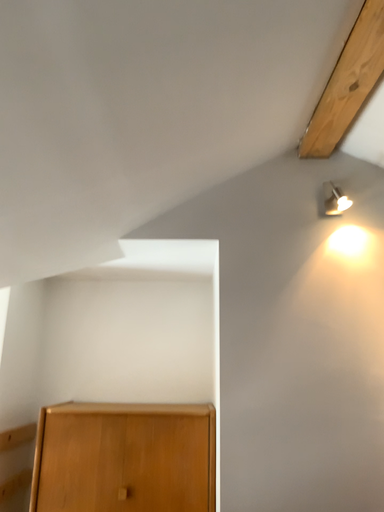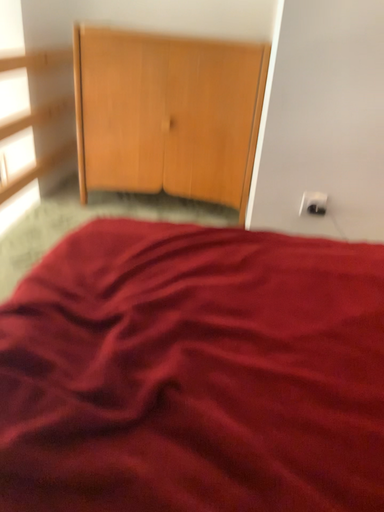
Question: How did the camera likely rotate when shooting the video?

Choices:
 (A) rotated upward
 (B) rotated downward

Answer: (B)